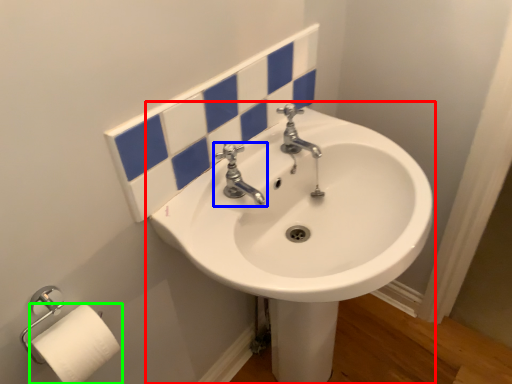
Question: Which is nearer to the sink (highlighted by a red box)? tap (highlighted by a blue box) or toilet paper (highlighted by a green box).

Choices:
 (A) tap
 (B) toilet paper

Answer: (A)